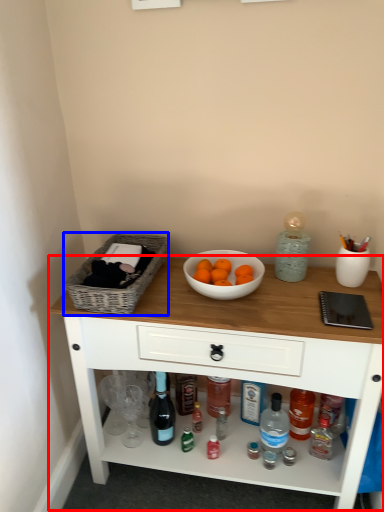
Question: Among these objects, which one is farthest to the camera, table (highlighted by a red box) or basket (highlighted by a blue box)?

Choices:
 (A) table
 (B) basket

Answer: (B)